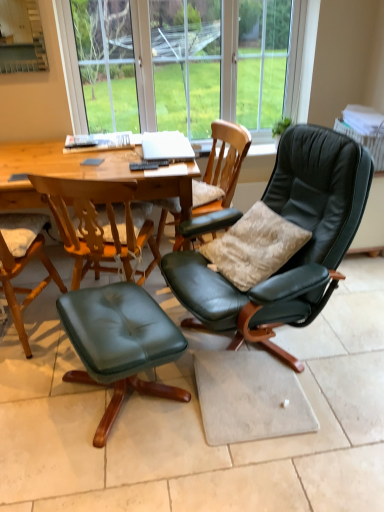
Image resolution: width=384 pixels, height=512 pixels. I want to click on free point in front of matte black leather chair at center, the 1th chair viewed from the right, so click(255, 446).